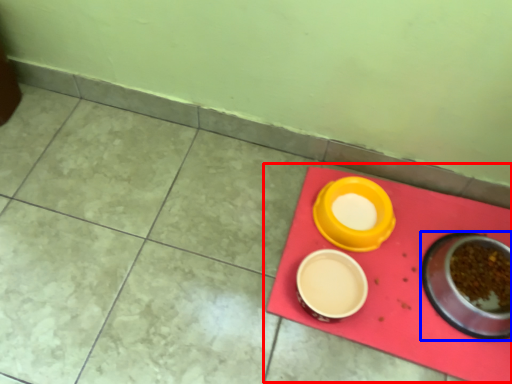
Question: Which point is closer to the camera, table (highlighted by a red box) or tableware (highlighted by a blue box)?

Choices:
 (A) table
 (B) tableware

Answer: (B)